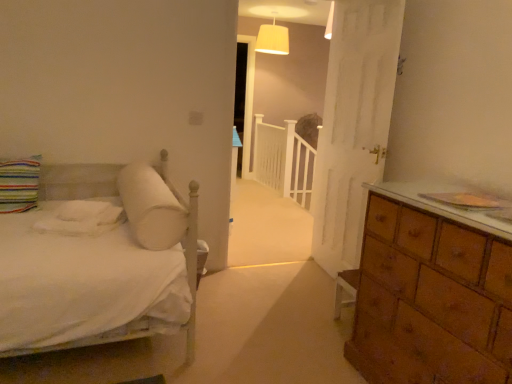
Question: Does white cotton sheet at left have a greater height compared to white soft pillow at upper left, positioned as the second pillow in left-to-right order?

Choices:
 (A) yes
 (B) no

Answer: (B)

Question: Is the depth of white cotton sheet at left less than that of white soft pillow at upper left, marked as the 1th pillow in a right-to-left arrangement?

Choices:
 (A) no
 (B) yes

Answer: (A)

Question: From the image's perspective, does white cotton sheet at left appear lower than white soft pillow at upper left, positioned as the second pillow in left-to-right order?

Choices:
 (A) yes
 (B) no

Answer: (A)

Question: Is white soft pillow at upper left, marked as the 1th pillow in a right-to-left arrangement, a part of white cotton sheet at left?

Choices:
 (A) no
 (B) yes

Answer: (A)

Question: Is white cotton sheet at left bigger than white soft pillow at upper left, marked as the 1th pillow in a right-to-left arrangement?

Choices:
 (A) yes
 (B) no

Answer: (B)

Question: Is white soft pillow at upper left, marked as the 1th pillow in a right-to-left arrangement, bigger or smaller than white fabric lampshade at upper center?

Choices:
 (A) small
 (B) big

Answer: (A)

Question: Would you say white soft pillow at upper left, marked as the 1th pillow in a right-to-left arrangement, is to the left or to the right of white fabric lampshade at upper center in the picture?

Choices:
 (A) right
 (B) left

Answer: (B)

Question: Is white soft pillow at upper left, marked as the 1th pillow in a right-to-left arrangement, inside the boundaries of white fabric lampshade at upper center, or outside?

Choices:
 (A) outside
 (B) inside

Answer: (A)

Question: In terms of width, does white soft pillow at upper left, marked as the 1th pillow in a right-to-left arrangement, look wider or thinner when compared to white fabric lampshade at upper center?

Choices:
 (A) wide
 (B) thin

Answer: (A)

Question: Is white fabric lampshade at upper center bigger or smaller than white soft pillow at upper left, marked as the 1th pillow in a right-to-left arrangement?

Choices:
 (A) big
 (B) small

Answer: (A)

Question: Is white fabric lampshade at upper center wider or thinner than white soft pillow at upper left, positioned as the second pillow in left-to-right order?

Choices:
 (A) thin
 (B) wide

Answer: (A)

Question: In the image, is white fabric lampshade at upper center on the left side or the right side of white soft pillow at upper left, positioned as the second pillow in left-to-right order?

Choices:
 (A) right
 (B) left

Answer: (A)

Question: Is point (257, 46) closer or farther from the camera than point (173, 223)?

Choices:
 (A) farther
 (B) closer

Answer: (A)

Question: Is white fabric lampshade at upper center wider or thinner than white cotton sheet at left?

Choices:
 (A) wide
 (B) thin

Answer: (A)

Question: Do you think white fabric lampshade at upper center is within white cotton sheet at left, or outside of it?

Choices:
 (A) outside
 (B) inside

Answer: (A)